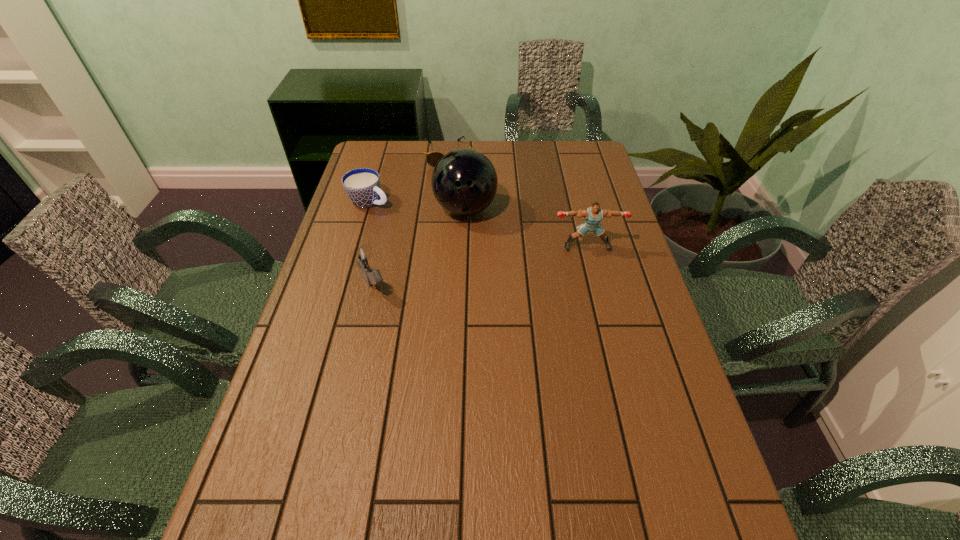
I want to click on vacant area that lies between the fourth tallest object and the shortest object, so click(x=409, y=178).

At what (x,y) coordinates should I click in order to perform the action: click on free area in between the nearest object and the bowling ball. Please return your answer as a coordinate pair (x, y). This screenshot has height=540, width=960. Looking at the image, I should click on (420, 248).

At what (x,y) coordinates should I click in order to perform the action: click on free space that is in between the igniter and the farthest object. Please return your answer as a coordinate pair (x, y). Looking at the image, I should click on (411, 220).

Find the location of a particular element. free area in between the bowling ball and the third shortest object is located at coordinates (420, 248).

You are a GUI agent. You are given a task and a screenshot of the screen. Output one action in this format:
    pyautogui.click(x=<x>, y=<y>)
    Task: Click on the vacant area between the second shortest object and the sunglasses
    
    Given the screenshot: What is the action you would take?
    pyautogui.click(x=409, y=178)

This screenshot has width=960, height=540. Find the location of `free space between the puncher and the cup`. free space between the puncher and the cup is located at coordinates (478, 224).

Image resolution: width=960 pixels, height=540 pixels. Identify the location of vacant space that is in between the cup and the second nearest object. (478, 224).

Where is `vacant area that lies between the bowling ball and the fourth farthest object`? Image resolution: width=960 pixels, height=540 pixels. vacant area that lies between the bowling ball and the fourth farthest object is located at coordinates (526, 228).

Identify the location of free spot between the fourth shortest object and the cup. (478, 224).

I want to click on unoccupied position between the nearest object and the shortest object, so click(x=411, y=220).